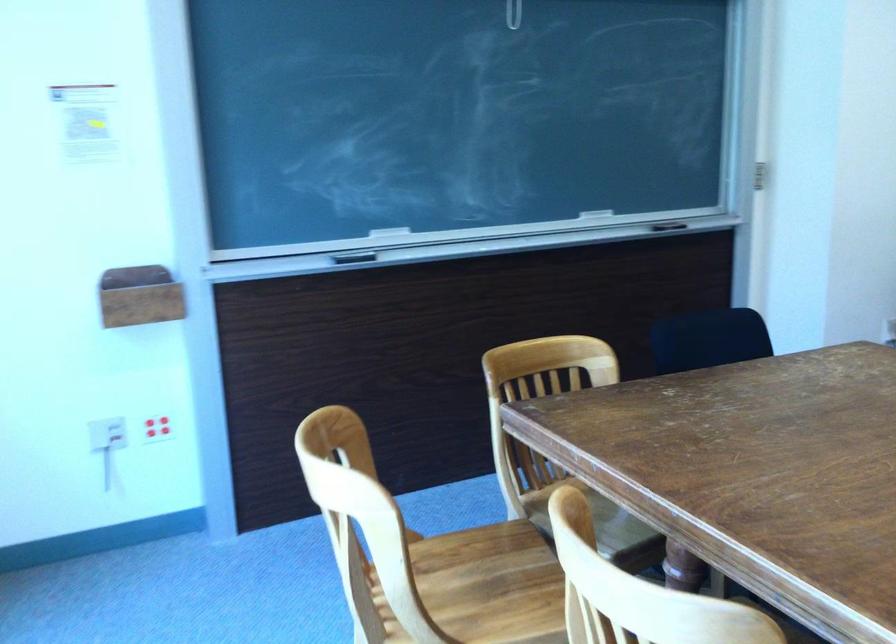
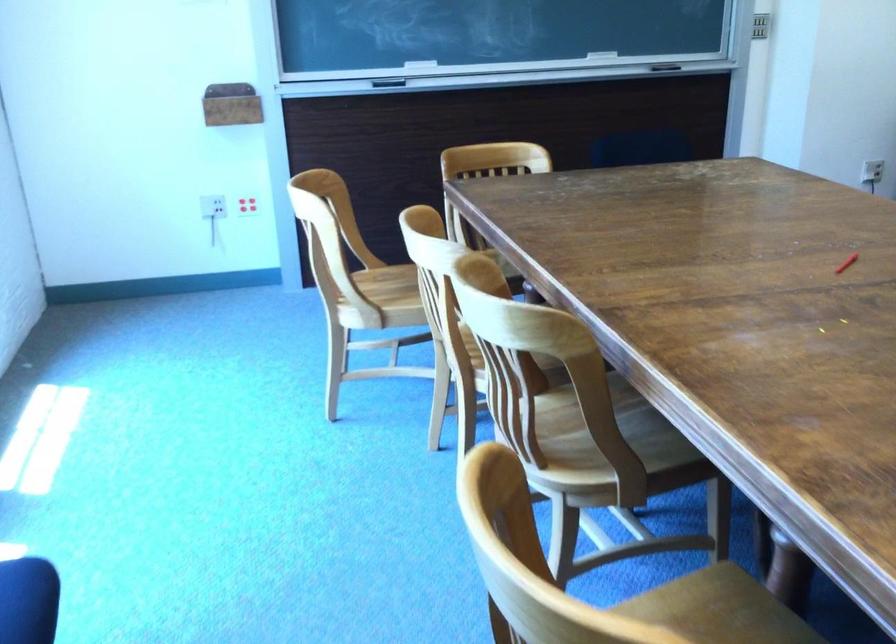
In the second image, find the point that corresponds to [675,234] in the first image.

(665, 67)